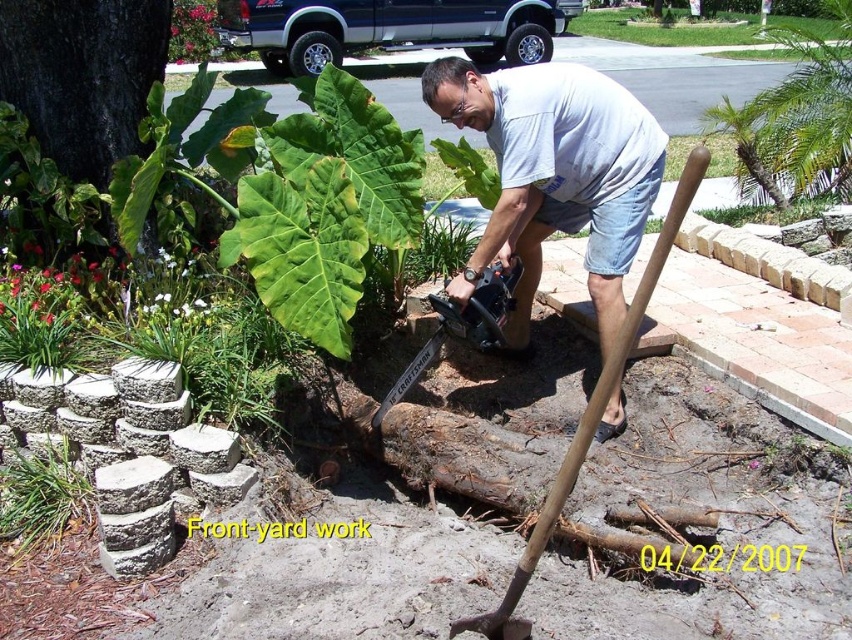
What is located at the point marked by coordinates (39, 496) in the image?

The point marked by coordinates (39, 496) is green grass at lower left.

You are a gardener planning to plant a new tree in the front yard. You notice the dark green leafy tree at upper left and the green leafy plant at upper center. Which of these two is positioned lower in the scene?

The dark green leafy tree at upper left is positioned lower than the green leafy plant at upper center.